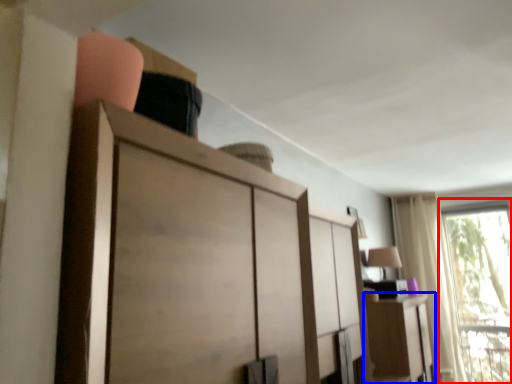
Question: Which object appears closest to the camera in this image, window (highlighted by a red box) or cabinetry (highlighted by a blue box)?

Choices:
 (A) window
 (B) cabinetry

Answer: (B)